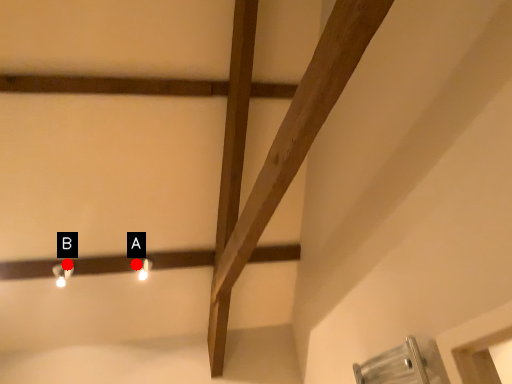
Question: Two points are circled on the image, labeled by A and B beside each circle. Which point is farther to the camera?

Choices:
 (A) A is further
 (B) B is further

Answer: (A)